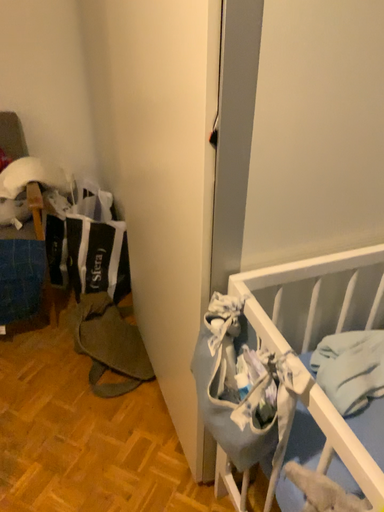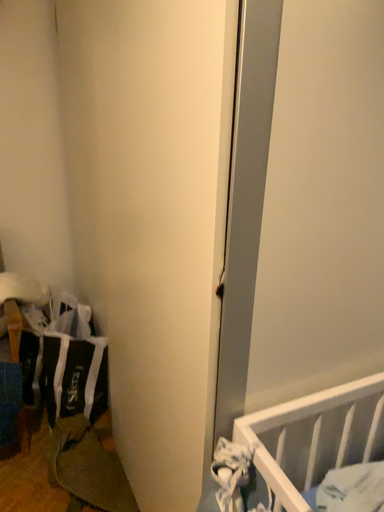
Question: How did the camera likely rotate when shooting the video?

Choices:
 (A) rotated downward
 (B) rotated upward

Answer: (B)